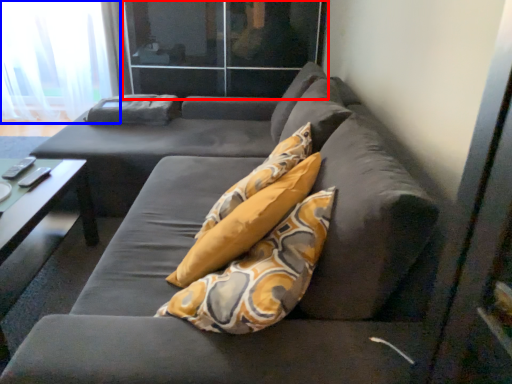
Question: Which point is closer to the camera, glass door (highlighted by a red box) or curtain (highlighted by a blue box)?

Choices:
 (A) glass door
 (B) curtain

Answer: (A)